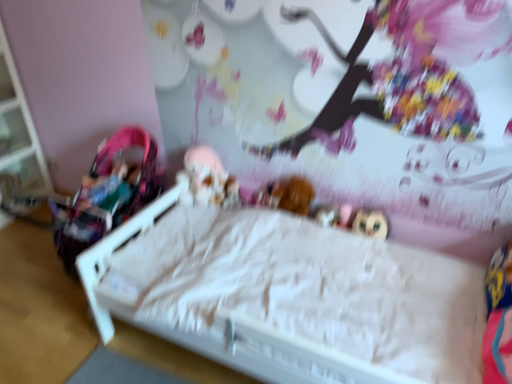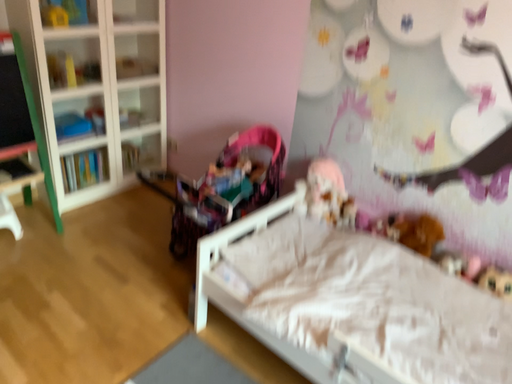
Question: Which way did the camera rotate in the video?

Choices:
 (A) rotated left
 (B) rotated right

Answer: (A)